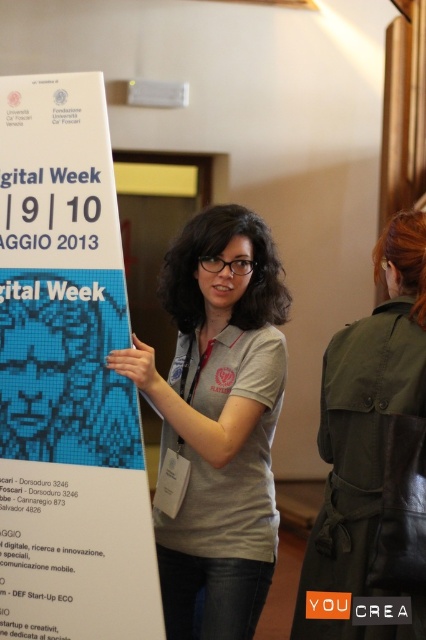
Can you confirm if gray fabric shirt at center is bigger than green leather jacket at upper right?

Correct, gray fabric shirt at center is larger in size than green leather jacket at upper right.

Does gray fabric shirt at center have a greater height compared to green leather jacket at upper right?

Yes, gray fabric shirt at center is taller than green leather jacket at upper right.

The width and height of the screenshot is (426, 640). Find the location of `gray fabric shirt at center`. gray fabric shirt at center is located at coordinates (218, 419).

Where is `gray fabric shirt at center`? The height and width of the screenshot is (640, 426). gray fabric shirt at center is located at coordinates (218, 419).

From the picture: Is white paper poster at upper left in front of gray fabric shirt at center?

Yes, white paper poster at upper left is closer to the viewer.

Find the location of a particular element. Image resolution: width=426 pixels, height=640 pixels. white paper poster at upper left is located at coordinates (66, 378).

Can you confirm if white paper poster at upper left is bigger than green leather jacket at upper right?

Incorrect, white paper poster at upper left is not larger than green leather jacket at upper right.

In the scene shown: Which is below, white paper poster at upper left or green leather jacket at upper right?

Positioned lower is green leather jacket at upper right.

Between point (104, 531) and point (379, 262), which one is positioned behind?

The point (379, 262) is behind.

At what (x,y) coordinates should I click in order to perform the action: click on white paper poster at upper left. Please return your answer as a coordinate pair (x, y). The image size is (426, 640). Looking at the image, I should click on (66, 378).